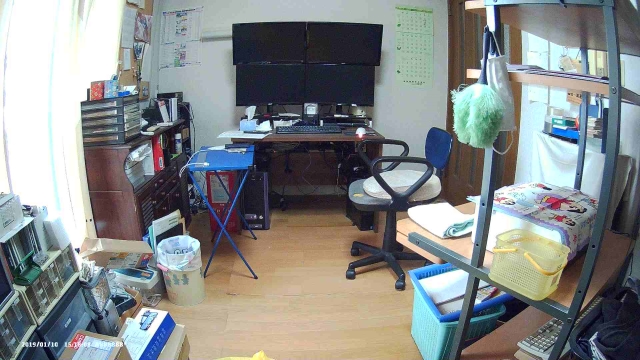
You are a GUI agent. You are given a task and a screenshot of the screen. Output one action in this format:
    pyautogui.click(x=<x>, y=<y>)
    Task: Click on the bin
    The image size is (640, 360).
    Given the screenshot: What is the action you would take?
    pyautogui.click(x=443, y=344), pyautogui.click(x=458, y=315)